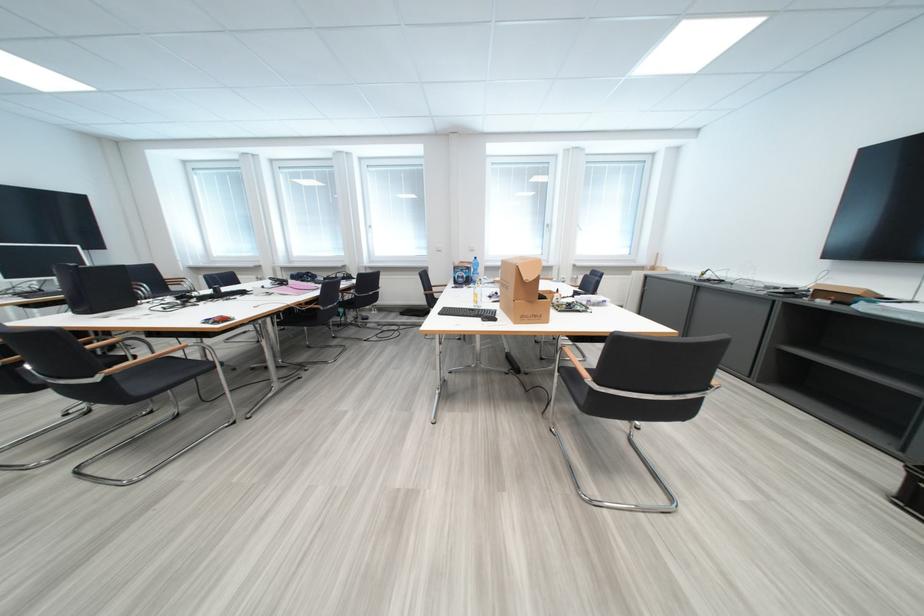
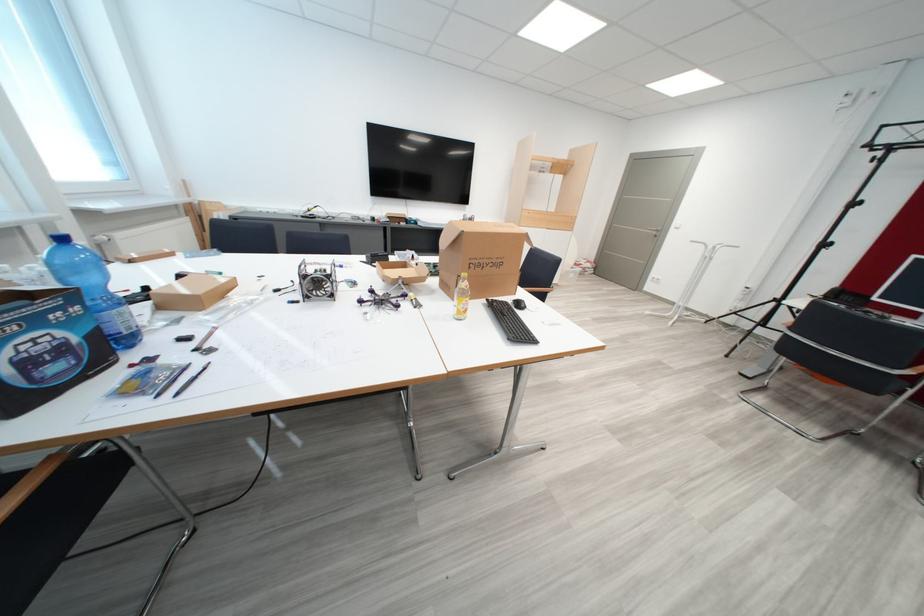
Find the pixel in the second image that matches the point at 472,273 in the first image.

(46, 323)